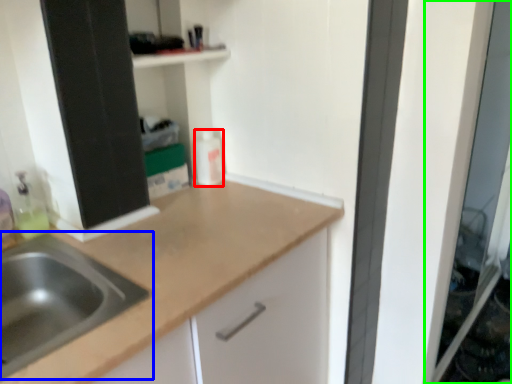
Question: Which object is the farthest from bottle (highlighted by a red box)? Choose among these: sink (highlighted by a blue box) or screen door (highlighted by a green box).

Choices:
 (A) sink
 (B) screen door

Answer: (B)